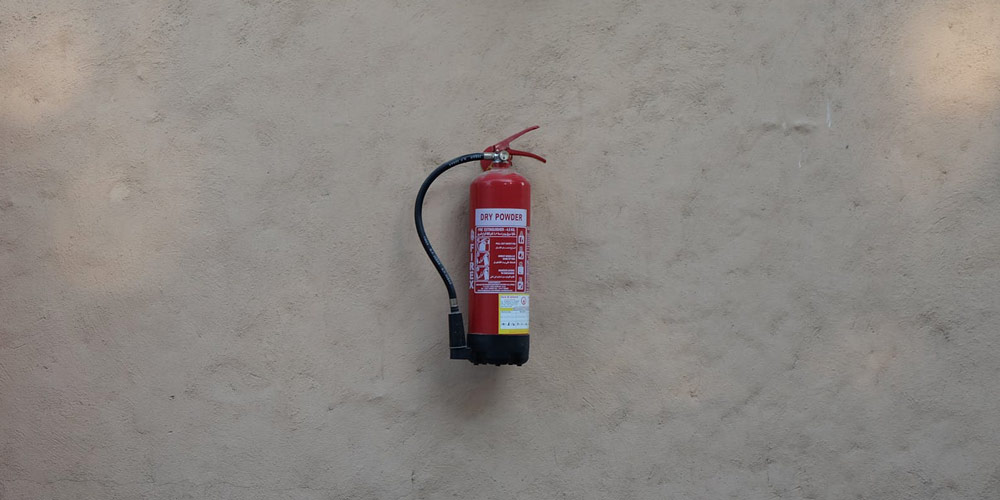
Find the location of a particular element. wall is located at coordinates (679, 134).